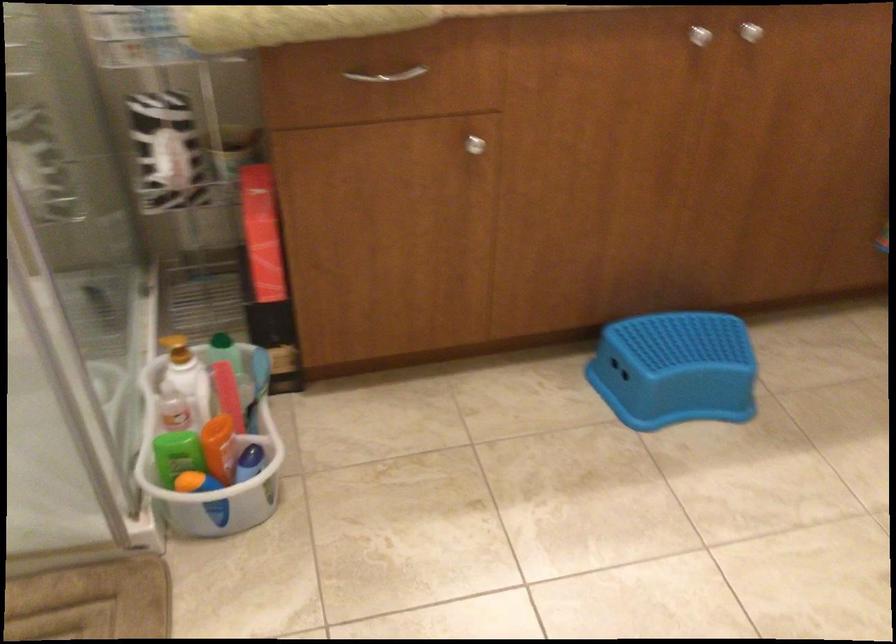
Find the location of `blue plastic bottle`. blue plastic bottle is located at coordinates (255, 451).